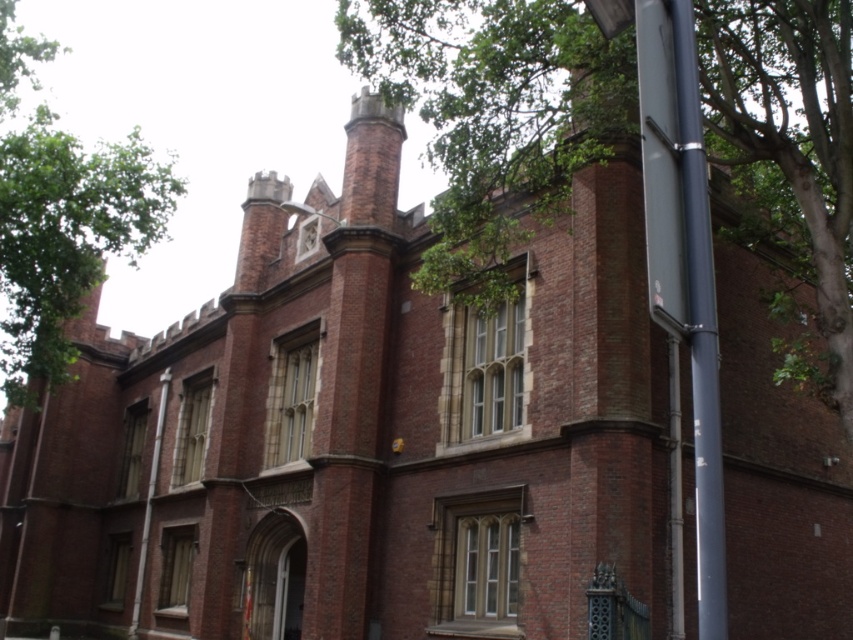
You are an architect assessing the building for potential renovations. You notice the green leafy tree at upper right and the smooth metallic pole at right. Which object would require more space for maintenance access due to its size?

The green leafy tree at upper right requires more space for maintenance access because it is larger in size than the smooth metallic pole at right.

You are an architect analyzing the placement of the green leafy tree at upper right in the image. Based on its coordinates, can you determine its location relative to the center of the building?

The green leafy tree at upper right is located at coordinates point (495, 106), which places it to the left and above the center of the building.

You are standing in front of the historic brick building and notice a green leafy tree at upper left and a smooth metallic pole at right. Which object is positioned higher in the image?

The green leafy tree at upper left is positioned higher than the smooth metallic pole at right.